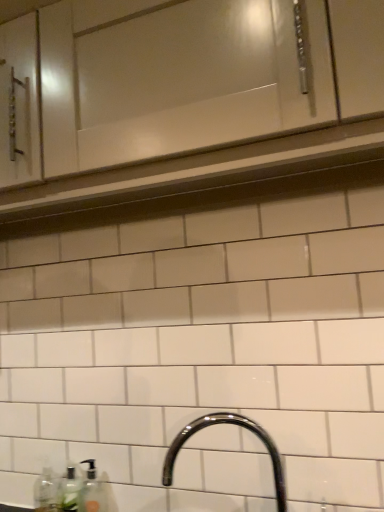
Question: Is clear plastic bottle at lower left, which appears as the first bottle when viewed from the left, oriented away from white glossy cabinet at upper center?

Choices:
 (A) no
 (B) yes

Answer: (A)

Question: Is clear plastic bottle at lower left, the 2th bottle positioned from the right, completely or partially outside of white glossy cabinet at upper center?

Choices:
 (A) yes
 (B) no

Answer: (A)

Question: From the image's perspective, is clear plastic bottle at lower left, the 2th bottle positioned from the right, located beneath white glossy cabinet at upper center?

Choices:
 (A) yes
 (B) no

Answer: (A)

Question: From the image's perspective, is clear plastic bottle at lower left, which appears as the first bottle when viewed from the left, on white glossy cabinet at upper center?

Choices:
 (A) no
 (B) yes

Answer: (A)

Question: Does clear plastic bottle at lower left, which appears as the first bottle when viewed from the left, have a lesser width compared to white glossy cabinet at upper center?

Choices:
 (A) no
 (B) yes

Answer: (B)

Question: Is clear plastic bottle at lower left, the 2th bottle positioned from the right, to the right of white glossy cabinet at upper center from the viewer's perspective?

Choices:
 (A) no
 (B) yes

Answer: (A)

Question: Can you confirm if glossy chrome faucet at lower center is positioned to the left of clear glass soap dispenser at lower left, the second bottle viewed from the left?

Choices:
 (A) yes
 (B) no

Answer: (B)

Question: Does glossy chrome faucet at lower center come behind clear glass soap dispenser at lower left, the second bottle viewed from the left?

Choices:
 (A) yes
 (B) no

Answer: (B)

Question: Is glossy chrome faucet at lower center smaller than clear glass soap dispenser at lower left, the first bottle in the right-to-left sequence?

Choices:
 (A) yes
 (B) no

Answer: (B)

Question: Is glossy chrome faucet at lower center oriented away from clear glass soap dispenser at lower left, the first bottle in the right-to-left sequence?

Choices:
 (A) no
 (B) yes

Answer: (A)

Question: Can you see glossy chrome faucet at lower center touching clear glass soap dispenser at lower left, the second bottle viewed from the left?

Choices:
 (A) yes
 (B) no

Answer: (B)

Question: Considering the relative sizes of glossy chrome faucet at lower center and clear glass soap dispenser at lower left, the first bottle in the right-to-left sequence, in the image provided, is glossy chrome faucet at lower center shorter than clear glass soap dispenser at lower left, the first bottle in the right-to-left sequence,?

Choices:
 (A) yes
 (B) no

Answer: (B)

Question: Is translucent plastic soap dispenser at lower left positioned with its back to clear plastic bottle at lower left, the 2th bottle positioned from the right?

Choices:
 (A) no
 (B) yes

Answer: (A)